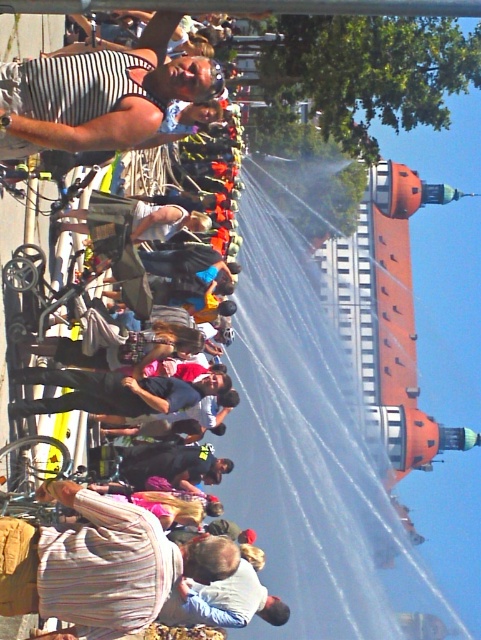
Question: Is striped fabric shirt at lower left further to the viewer compared to striped fabric tank top at upper left?

Choices:
 (A) yes
 (B) no

Answer: (A)

Question: Which point is closer to the camera taking this photo?

Choices:
 (A) (5, 520)
 (B) (149, 104)

Answer: (A)

Question: Can you confirm if striped fabric shirt at lower left is positioned below striped fabric tank top at upper left?

Choices:
 (A) yes
 (B) no

Answer: (A)

Question: Is striped fabric shirt at lower left positioned at the back of striped fabric tank top at upper left?

Choices:
 (A) yes
 (B) no

Answer: (A)